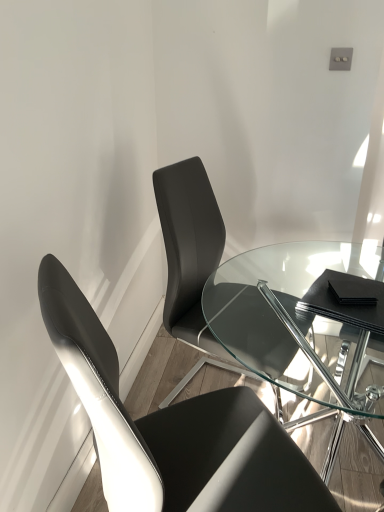
Question: Is matte black chair at center, acting as the 2th chair starting from the front, surrounding black leather chair at left, the first chair viewed from the front?

Choices:
 (A) no
 (B) yes

Answer: (A)

Question: Does matte black chair at center, acting as the 2th chair starting from the front, have a greater height compared to black leather chair at left, the first chair viewed from the front?

Choices:
 (A) yes
 (B) no

Answer: (B)

Question: Is matte black chair at center, acting as the 2th chair starting from the front, located outside black leather chair at left, the first chair viewed from the front?

Choices:
 (A) yes
 (B) no

Answer: (A)

Question: Is matte black chair at center, positioned as the 1th chair in back-to-front order, closer to camera compared to black leather chair at left, the first chair viewed from the front?

Choices:
 (A) yes
 (B) no

Answer: (B)

Question: Is black leather chair at left, the 2th chair viewed from the back, at the back of matte black chair at center, acting as the 2th chair starting from the front?

Choices:
 (A) yes
 (B) no

Answer: (B)

Question: Is point (208, 352) positioned closer to the camera than point (99, 436)?

Choices:
 (A) closer
 (B) farther

Answer: (B)

Question: In terms of width, does matte black chair at center, positioned as the 1th chair in back-to-front order, look wider or thinner when compared to black leather chair at left, the first chair viewed from the front?

Choices:
 (A) thin
 (B) wide

Answer: (A)

Question: Considering the positions of matte black chair at center, acting as the 2th chair starting from the front, and black leather chair at left, the 2th chair viewed from the back, in the image, is matte black chair at center, acting as the 2th chair starting from the front, bigger or smaller than black leather chair at left, the 2th chair viewed from the back,?

Choices:
 (A) small
 (B) big

Answer: (A)

Question: Which is correct: matte black chair at center, acting as the 2th chair starting from the front, is inside black leather chair at left, the 2th chair viewed from the back, or outside of it?

Choices:
 (A) inside
 (B) outside

Answer: (B)

Question: Considering their positions, is matte black chair at center, positioned as the 1th chair in back-to-front order, located in front of or behind transparent glass table at center?

Choices:
 (A) front
 (B) behind

Answer: (B)

Question: Considering the positions of point (309, 333) and point (274, 372), is point (309, 333) closer or farther from the camera than point (274, 372)?

Choices:
 (A) closer
 (B) farther

Answer: (B)

Question: In terms of height, does matte black chair at center, acting as the 2th chair starting from the front, look taller or shorter compared to transparent glass table at center?

Choices:
 (A) short
 (B) tall

Answer: (B)

Question: From the image's perspective, is matte black chair at center, acting as the 2th chair starting from the front, located above or below transparent glass table at center?

Choices:
 (A) below
 (B) above

Answer: (B)

Question: Considering the positions of point 299,254 and point 175,222, is point 299,254 closer or farther from the camera than point 175,222?

Choices:
 (A) closer
 (B) farther

Answer: (B)

Question: Considering the positions of transparent glass table at center and matte black chair at center, acting as the 2th chair starting from the front, in the image, is transparent glass table at center taller or shorter than matte black chair at center, acting as the 2th chair starting from the front,?

Choices:
 (A) short
 (B) tall

Answer: (A)